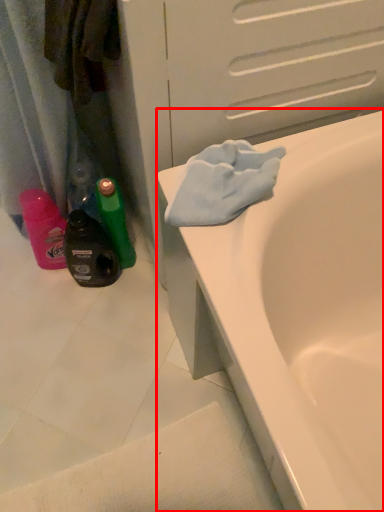
Question: From the image's perspective, what is the correct spatial relationship of bathtub (annotated by the red box) in relation to bottle?

Choices:
 (A) above
 (B) below

Answer: (B)